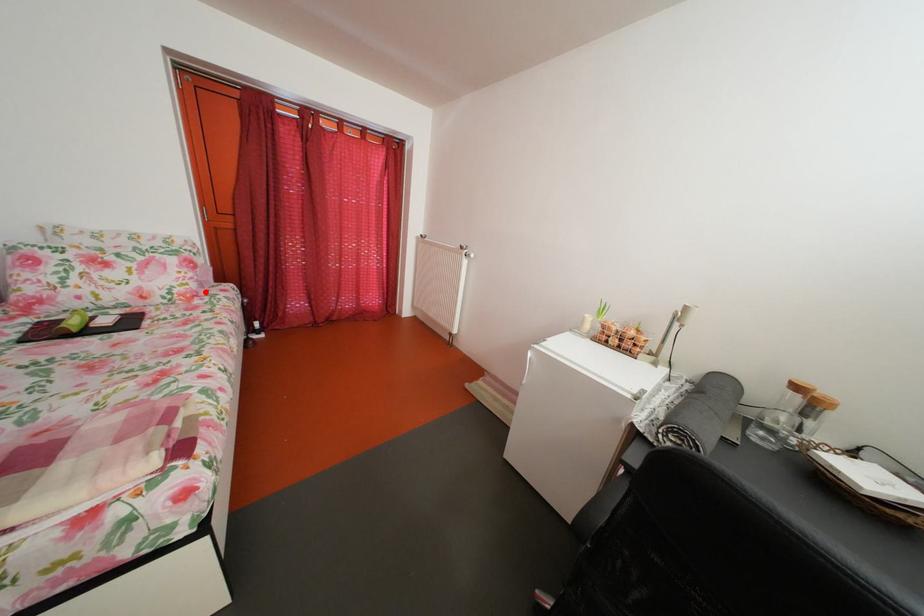
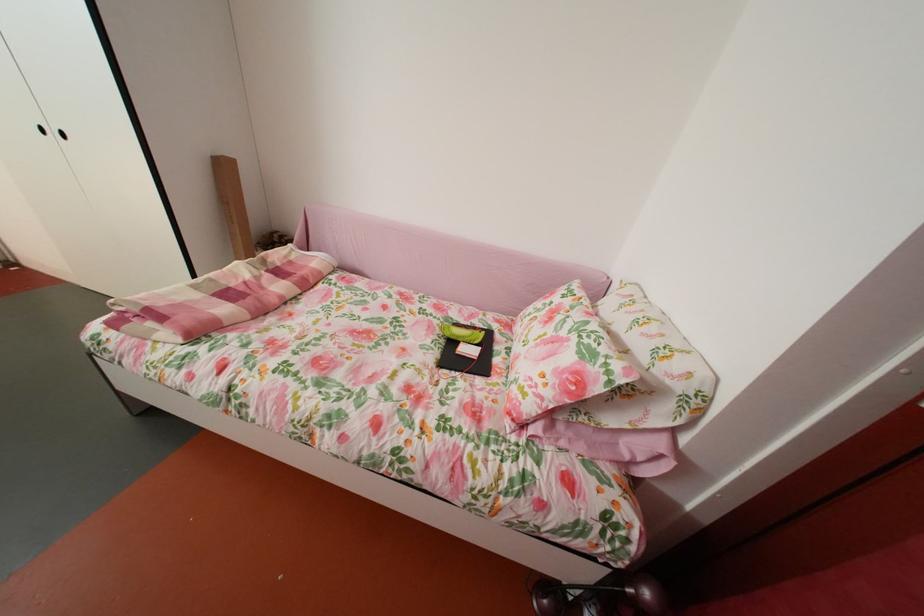
Question: I am providing you with two images of the same scene from different viewpoints. Image1 has a red point marked. In image2, the corresponding 3D location appears at what relative position? Reply with the corresponding letter.

Choices:
 (A) Closer
 (B) Farther

Answer: (B)